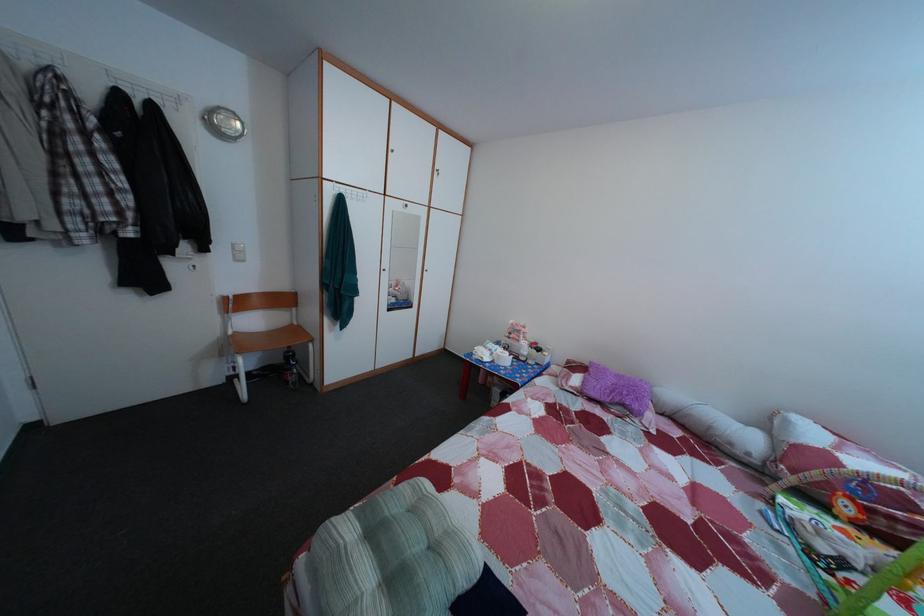
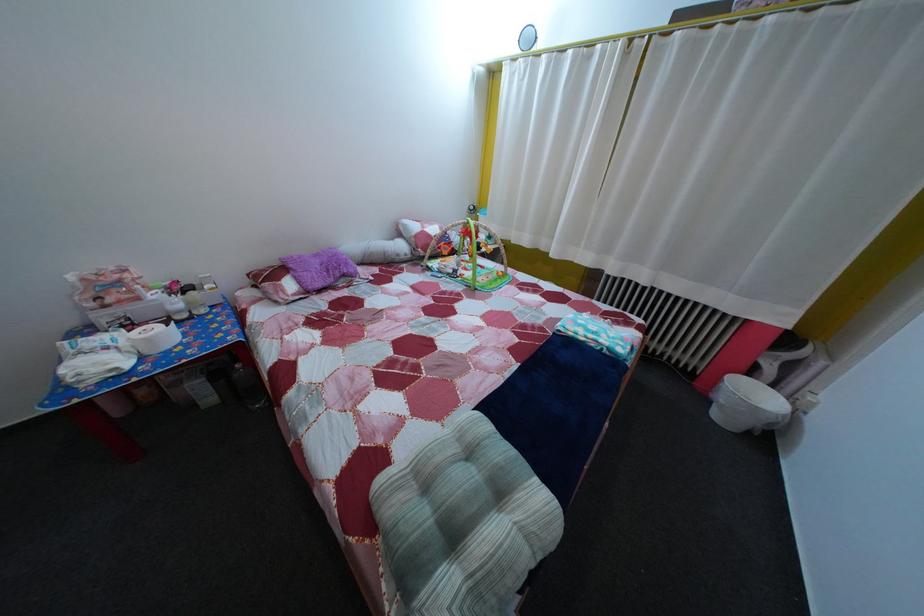
In the second image, find the point that corresponds to pixel 833 557 in the first image.

(459, 278)